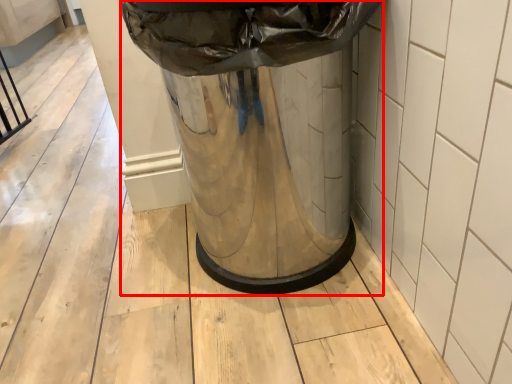
Question: Considering the relative positions of waste container (annotated by the red box) and tile in the image provided, where is waste container (annotated by the red box) located with respect to the staircase?

Choices:
 (A) right
 (B) left

Answer: (B)